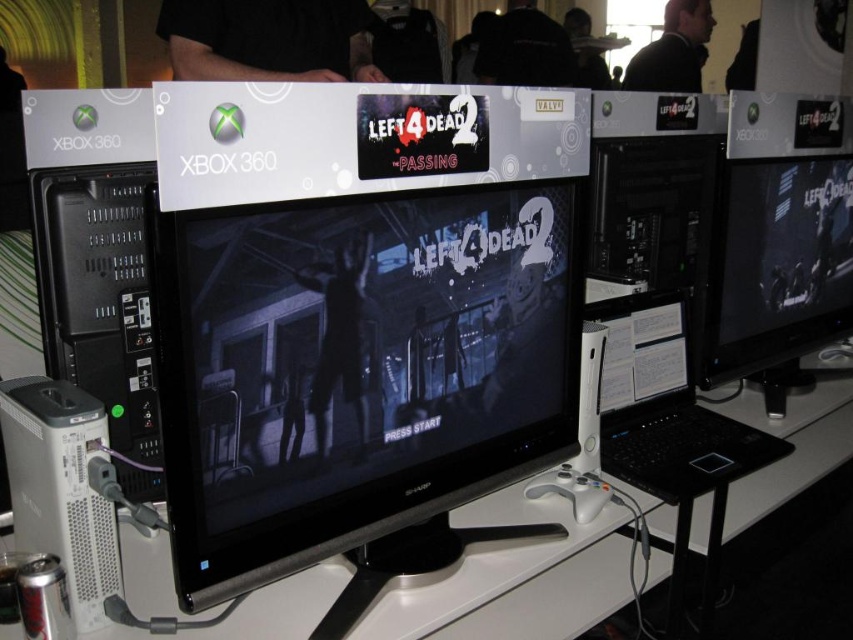
Between point (430, 376) and point (155, 451), which one is positioned in front?

Point (430, 376)

Between point (397, 204) and point (96, 230), which one is positioned in front?

Point (397, 204) is more forward.

The image size is (853, 640). I want to click on black glossy monitor at center, so click(357, 369).

Identify the location of black glossy monitor at center. (357, 369).

Which is behind, point (363, 349) or point (546, 602)?

The point (546, 602) is behind.

Is point (343, 237) behind point (508, 577)?

That is False.

The image size is (853, 640). What are the coordinates of `black glossy monitor at center` in the screenshot? It's located at (357, 369).

Which is behind, point (747, 321) or point (117, 209)?

The point (747, 321) is more distant.

Does point (782, 285) come closer to viewer compared to point (122, 170)?

No, (782, 285) is behind (122, 170).

Is point (788, 228) positioned after point (90, 321)?

Yes.

In order to click on matte black monitor at center in this screenshot , I will do `click(775, 262)`.